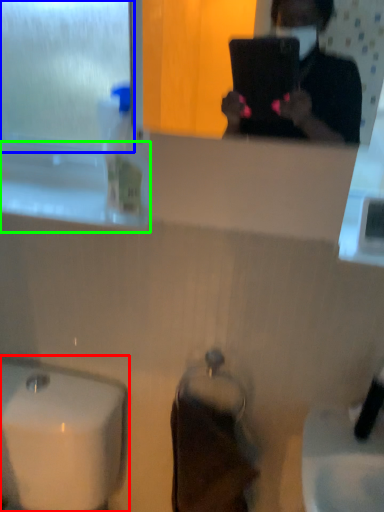
Question: Considering the real-world distances, which object is closest to sink (highlighted by a red box)? window screen (highlighted by a blue box) or window sill (highlighted by a green box).

Choices:
 (A) window screen
 (B) window sill

Answer: (B)